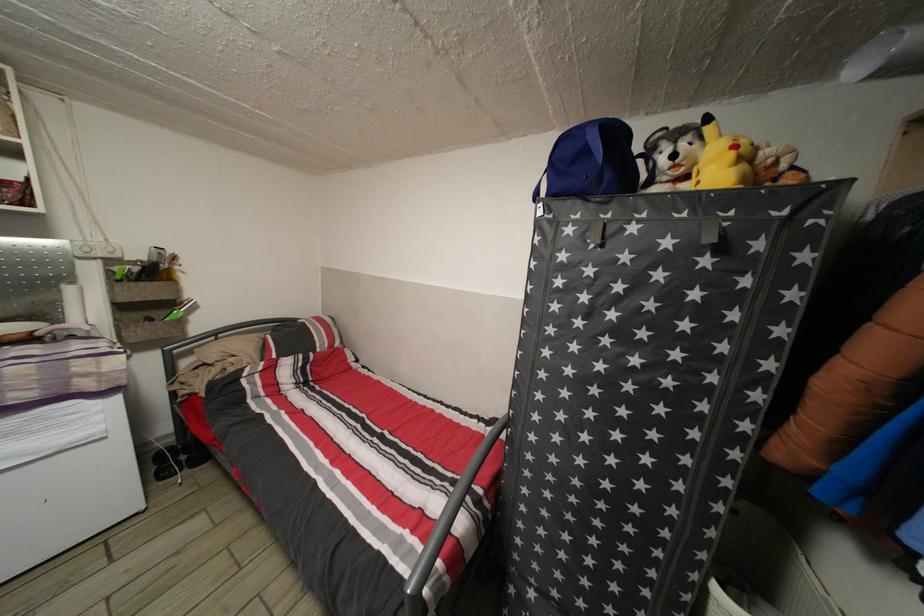
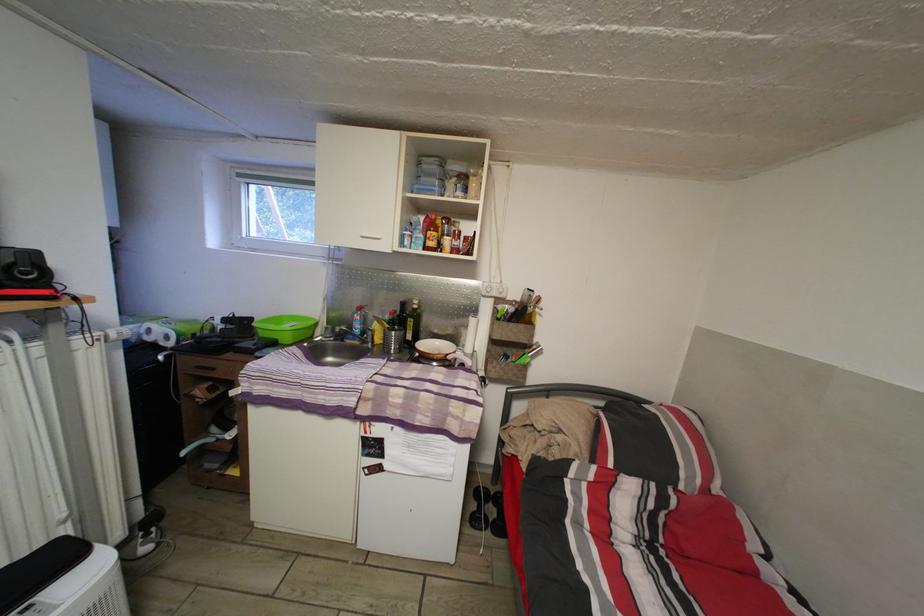
Locate, in the second image, the point that corresponds to pixel 177 455 in the first image.

(493, 498)